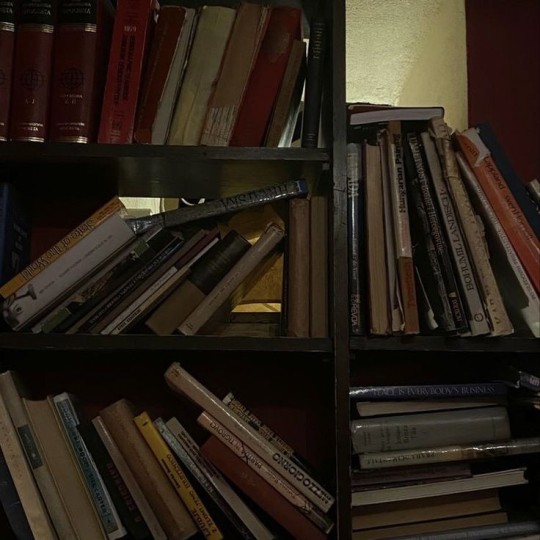
The height and width of the screenshot is (540, 540). In order to click on wooden shelves in this screenshot , I will do `click(276, 344)`, `click(390, 343)`, `click(263, 148)`.